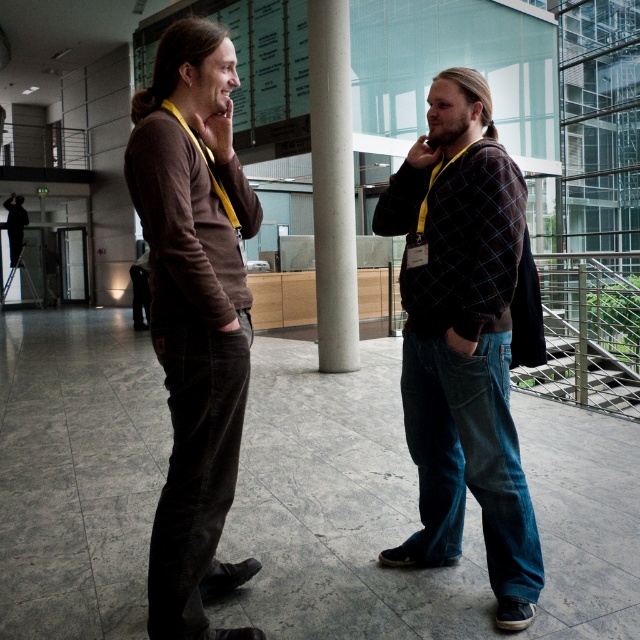
You are taking a photo of two people in the scene. You want to focus on the person at point [225,340] and the person at point [317,294]. Which person will be in focus if you focus on the closer one?

The person at point [225,340] will be in focus because it is closer to the camera than the person at point [317,294].

You are a maintenance worker who needs to place a 2.5 meter long safety barrier between the two people at point (419, 342). Will the barrier fit between them without overlapping either person?

The two people at point (419, 342) are 2.35 meters apart. Since the safety barrier is 2.5 meters long, which is longer than the distance between them, the barrier will overlap both individuals and cannot be placed without obstruction.

You are standing in the scene and want to locate the dark blue jeans at center. What are their coordinates?

The dark blue jeans at center are located at coordinates point (461, 339).